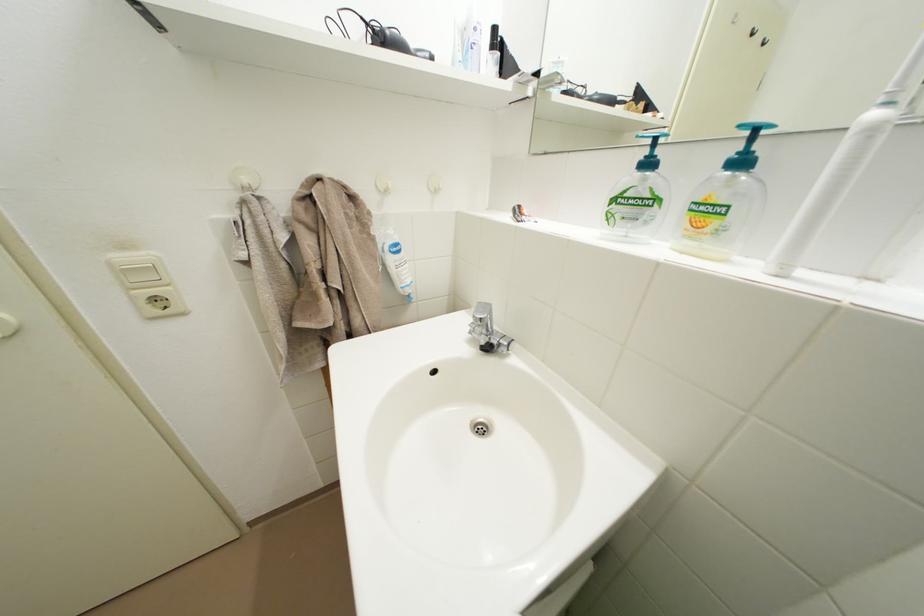
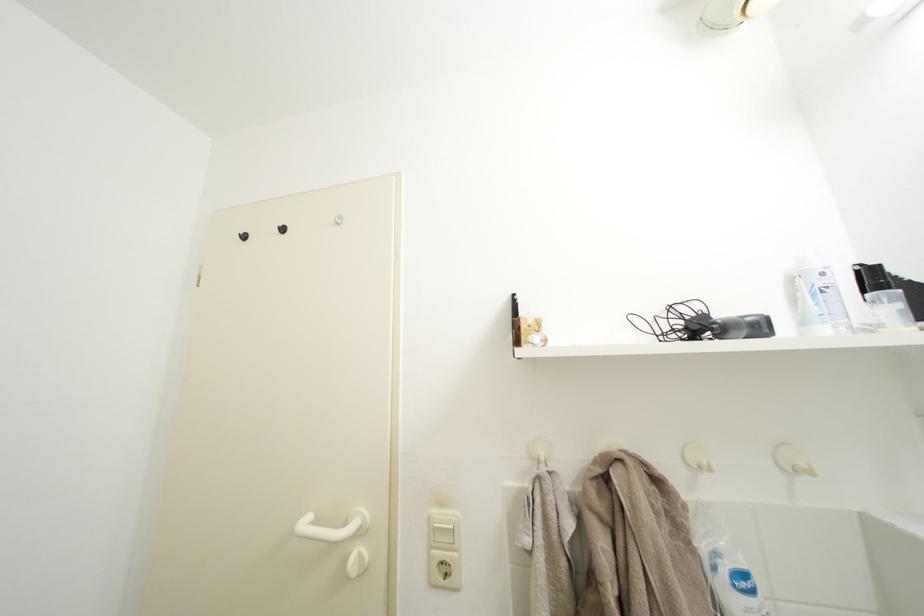
In the second image, find the point that corresponds to the point at 484,34 in the first image.

(833, 280)